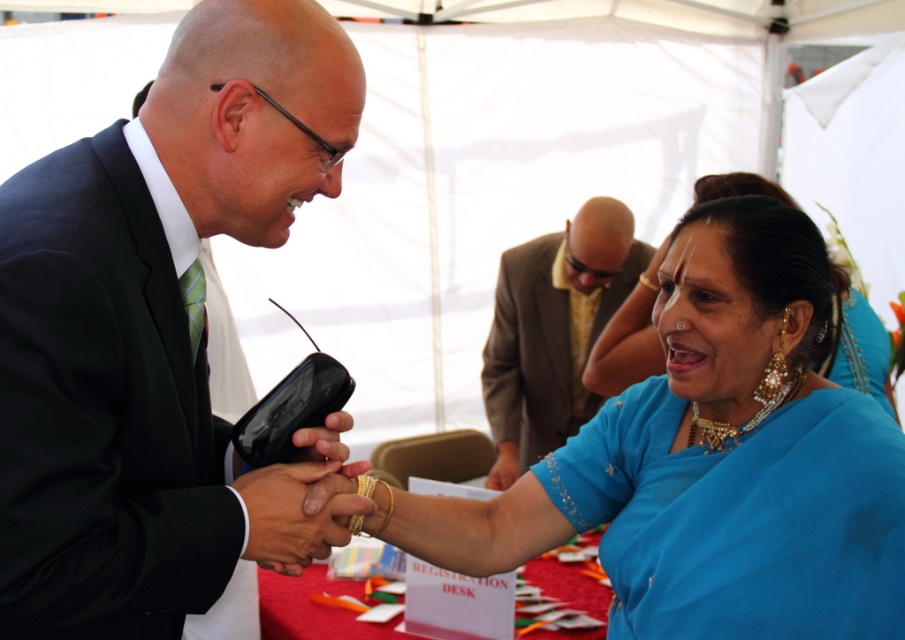
You are a photographer at the event and need to position yourself so that both the black matte suit at center and the brown textured suit at upper center are fully visible in your frame. Given their sizes, which one might require you to adjust your camera angle more to ensure it fits in the shot?

The brown textured suit at upper center requires more adjustment because it has a greater width than the black matte suit at center, so you need to widen your camera angle to accommodate its larger size.

You are standing at the point labeled point (0, 532) and want to move towards the point labeled point (602, 323). Based on the scene description, will you be moving towards the background or the foreground?

You will be moving towards the background because point (602, 323) is further from the viewer than point (0, 532).

In the scene shown: You are a photographer at the event and need to capture a photo that includes both the black matte suit at center and the blue silk saree at lower right. Based on their positions, which one should be placed lower in the frame to ensure both are visible?

The black matte suit at center is located below the blue silk saree at lower right, so to include both in the frame, the black matte suit at center should be placed lower since it is already positioned below the blue silk saree at lower right.